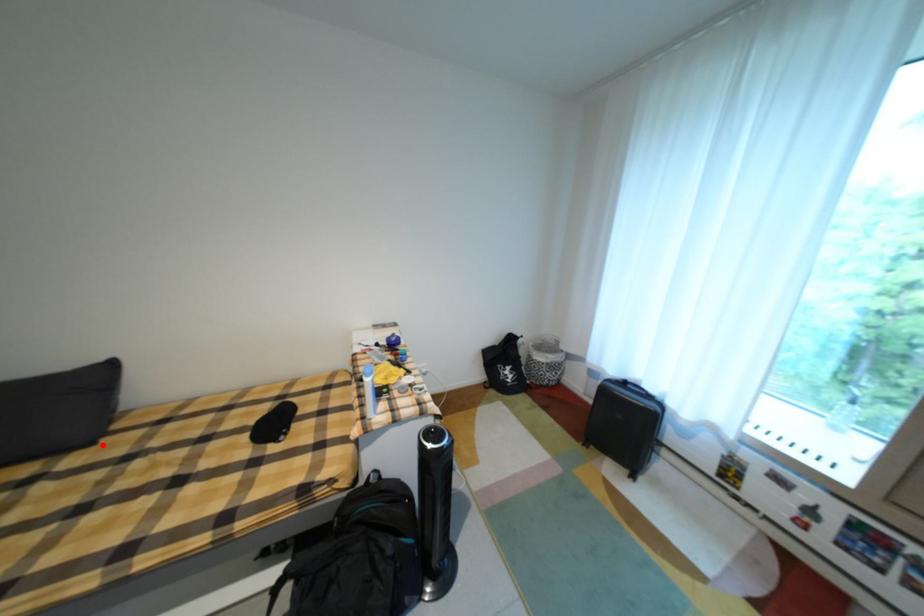
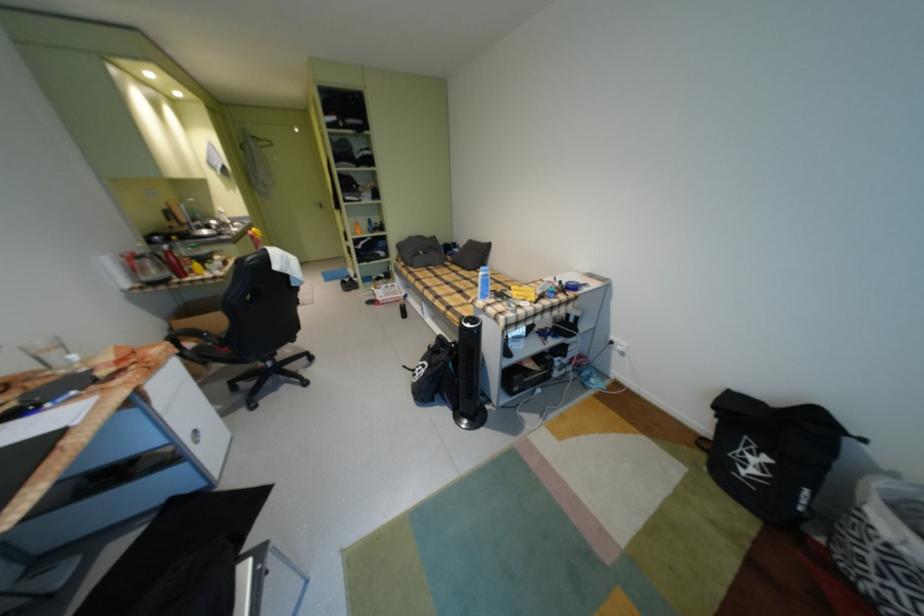
The point at the highlighted location is marked in the first image. Where is the corresponding point in the second image?

(479, 272)